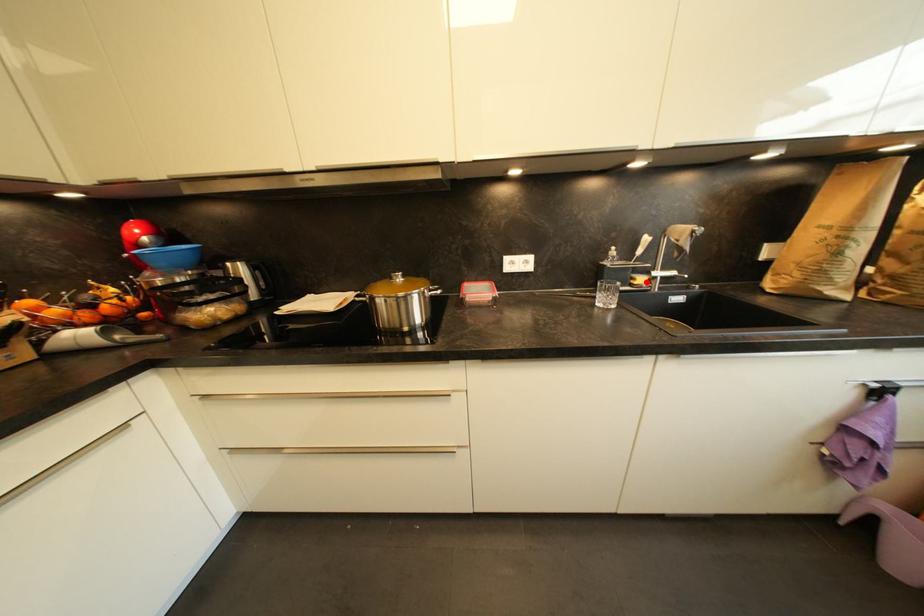
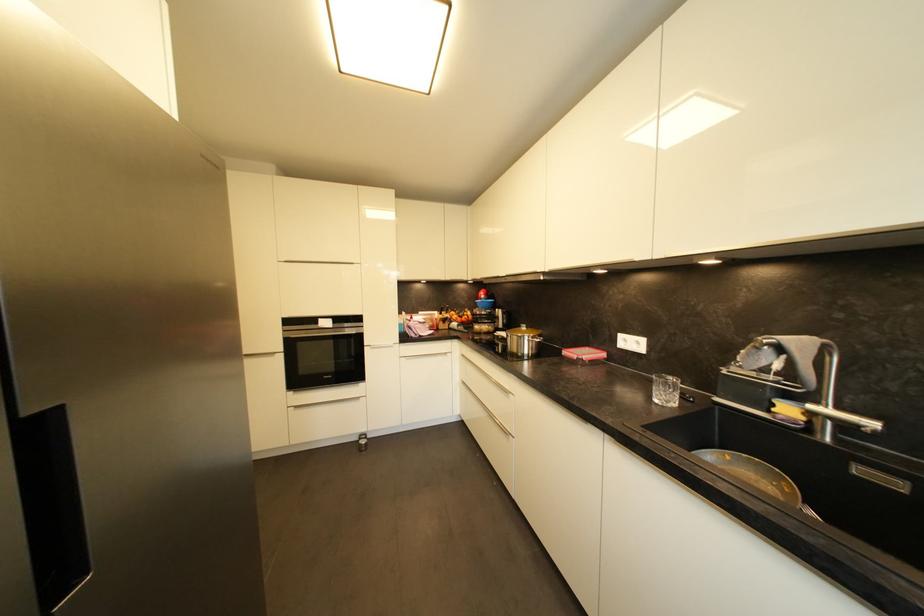
Find the pixel in the second image that matches the highlighted location in the first image.

(793, 411)